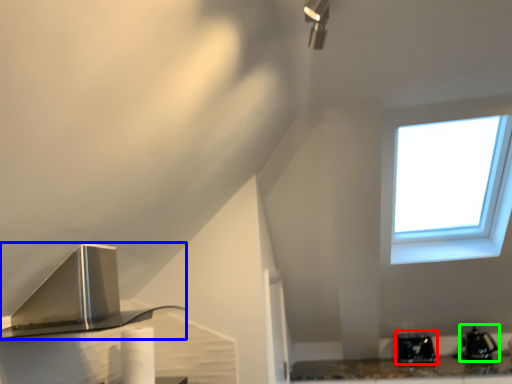
Question: Which object is the closest to the appliance (highlighted by a red box)? Choose among these: kitchen appliance (highlighted by a blue box) or appliance (highlighted by a green box).

Choices:
 (A) kitchen appliance
 (B) appliance

Answer: (B)